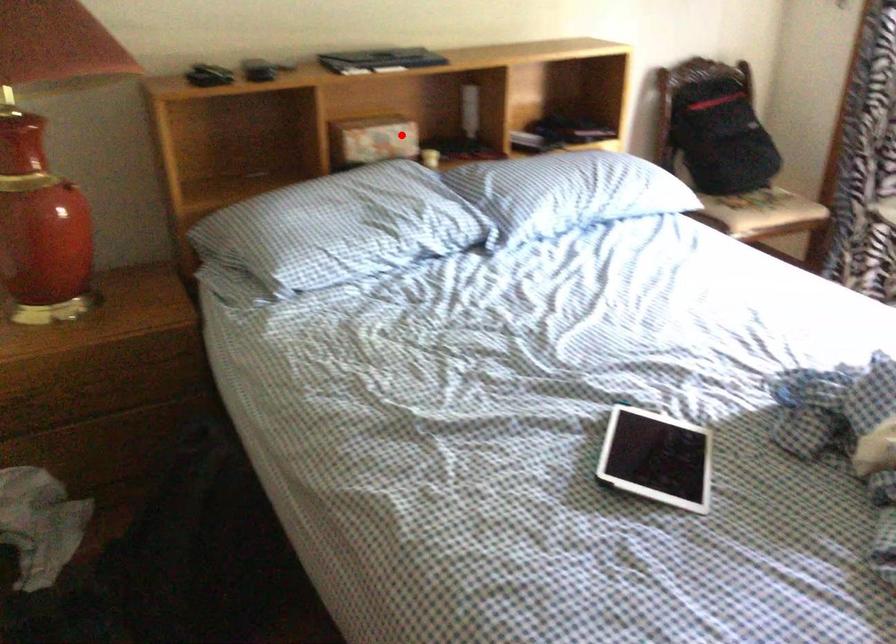
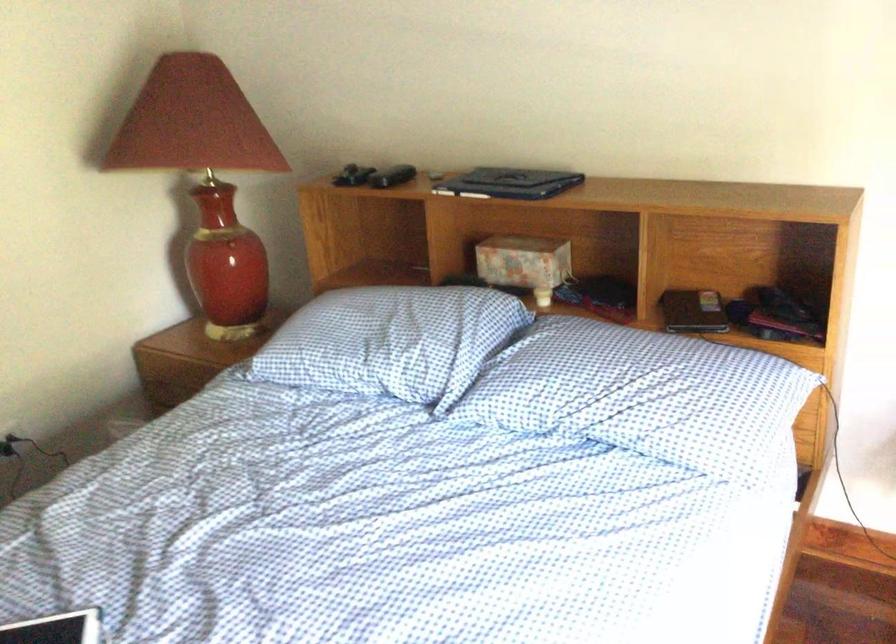
Question: I am providing you with two images of the same scene from different viewpoints. Given a red point in image1, look at the same physical point in image2. Is it:

Choices:
 (A) Closer to the viewpoint
 (B) Farther from the viewpoint

Answer: (A)